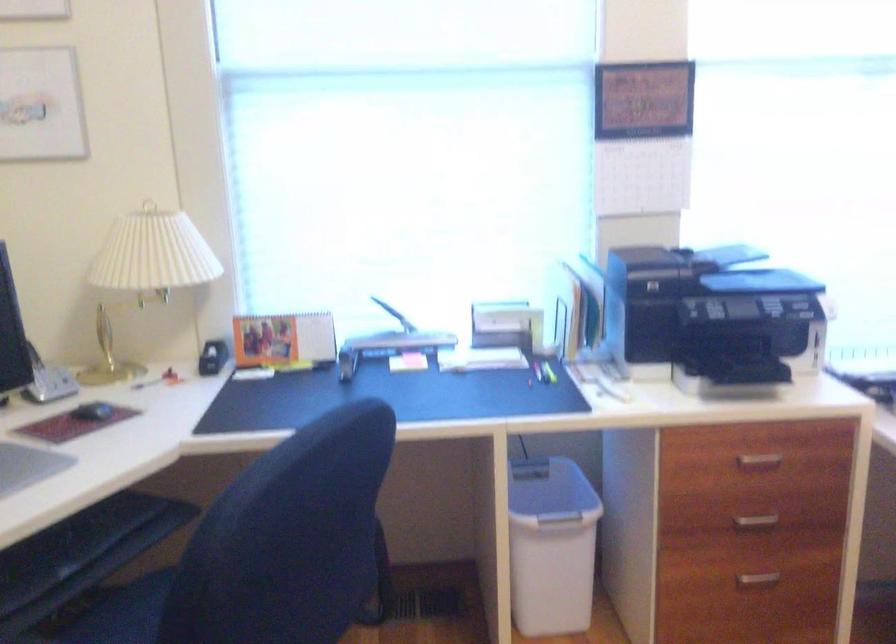
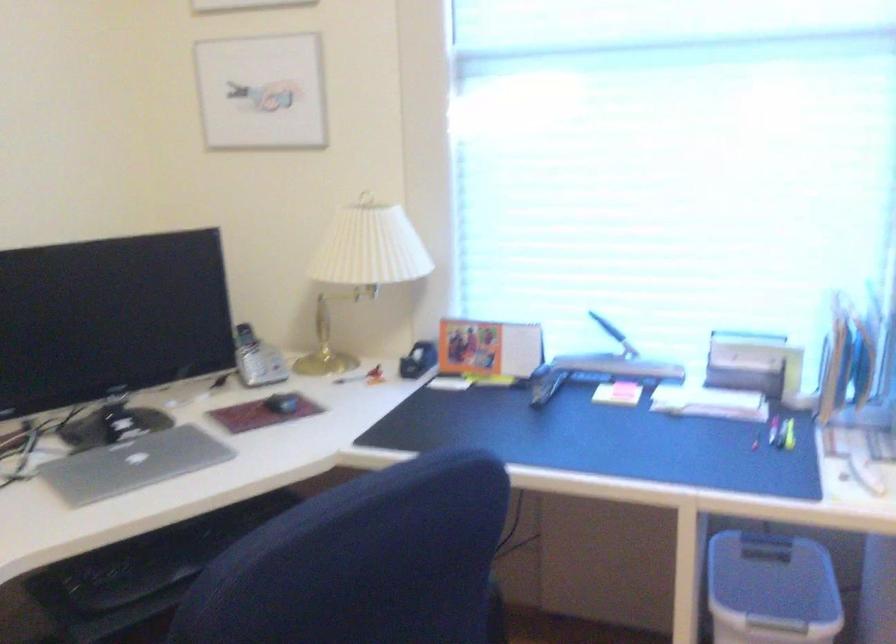
Question: The first image is from the beginning of the video and the second image is from the end. How did the camera likely rotate when shooting the video?

Choices:
 (A) Left
 (B) Right
 (C) Up
 (D) Down

Answer: (A)